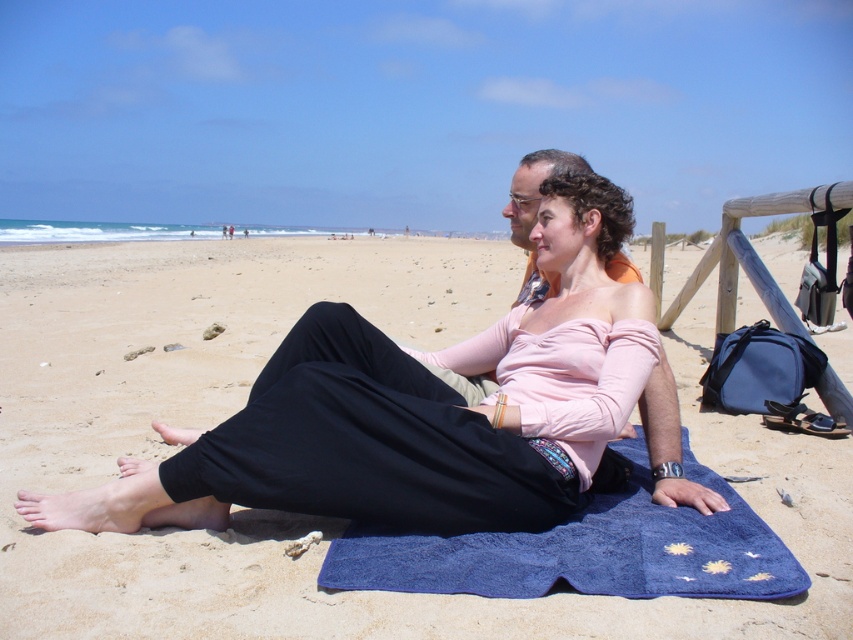
Between matte black pants at center and blue fabric towel at lower center, which one is positioned higher?

Positioned higher is matte black pants at center.

Based on the photo, how much distance is there between matte black pants at center and blue fabric towel at lower center?

matte black pants at center is 13.55 inches from blue fabric towel at lower center.

Is point (293, 433) farther from camera compared to point (335, 572)?

Yes, point (293, 433) is farther from viewer.

Locate an element on the screen. The height and width of the screenshot is (640, 853). matte black pants at center is located at coordinates (401, 413).